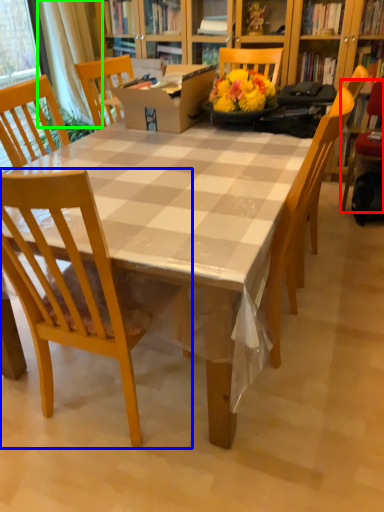
Question: Which object is positioned closest to chair (highlighted by a red box)? Select from chair (highlighted by a blue box) and curtain (highlighted by a green box).

Choices:
 (A) chair
 (B) curtain

Answer: (A)